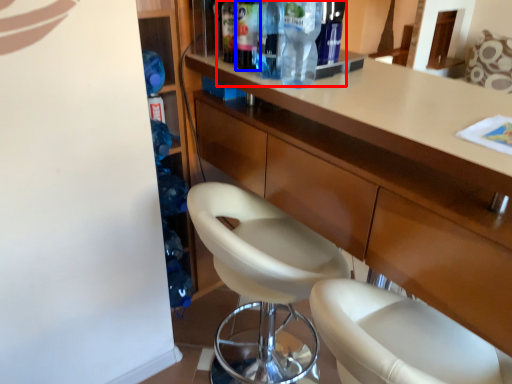
Question: Which point is closer to the camera, bottle (highlighted by a red box) or bottle (highlighted by a blue box)?

Choices:
 (A) bottle
 (B) bottle

Answer: (A)